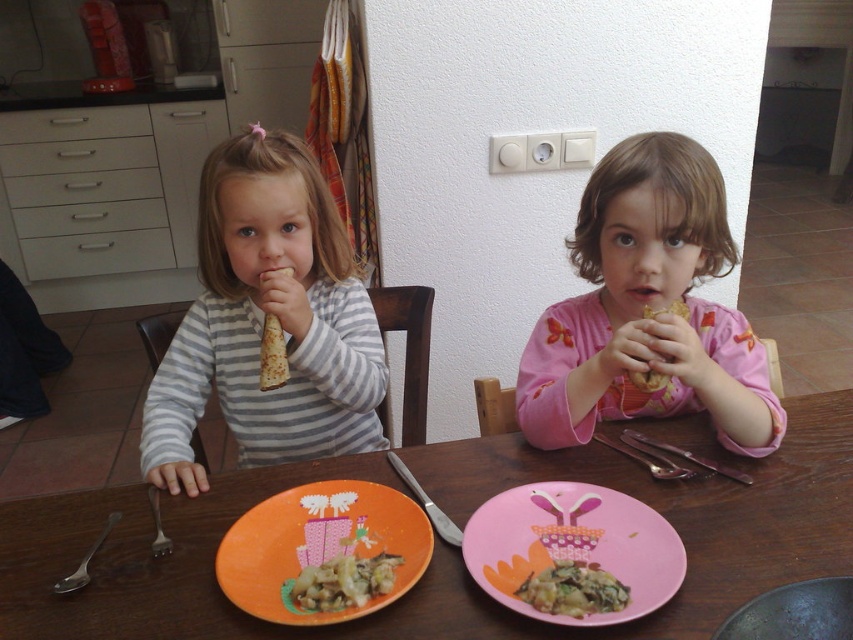
Does striped cotton shirt at center lie in front of silver metallic fork at lower left?

That is False.

Measure the distance between striped cotton shirt at center and silver metallic fork at lower left.

They are 15.79 inches apart.

Image resolution: width=853 pixels, height=640 pixels. What do you see at coordinates (262, 317) in the screenshot?
I see `striped cotton shirt at center` at bounding box center [262, 317].

The height and width of the screenshot is (640, 853). I want to click on striped cotton shirt at center, so click(x=262, y=317).

Looking at this image, measure the distance between brown crumbly bread at center and camera.

The distance of brown crumbly bread at center from camera is 36.35 inches.

Is brown crumbly bread at center further to the viewer compared to satin silver fork at lower left?

Yes, brown crumbly bread at center is further from the viewer.

You are a GUI agent. You are given a task and a screenshot of the screen. Output one action in this format:
    pyautogui.click(x=<x>, y=<y>)
    Task: Click on the brown crumbly bread at center
    The width and height of the screenshot is (853, 640).
    Given the screenshot: What is the action you would take?
    pyautogui.click(x=648, y=380)

Which is more to the left, wooden table at center or satin silver fork at lower left?

Positioned to the left is satin silver fork at lower left.

Who is higher up, wooden table at center or satin silver fork at lower left?

Positioned higher is wooden table at center.

This screenshot has height=640, width=853. Describe the element at coordinates (439, 540) in the screenshot. I see `wooden table at center` at that location.

Locate an element on the screen. This screenshot has width=853, height=640. wooden table at center is located at coordinates (x=439, y=540).